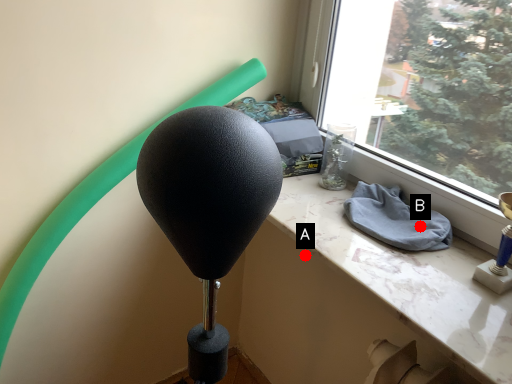
Question: Two points are circled on the image, labeled by A and B beside each circle. Which point is closer to the camera?

Choices:
 (A) A is closer
 (B) B is closer

Answer: (B)